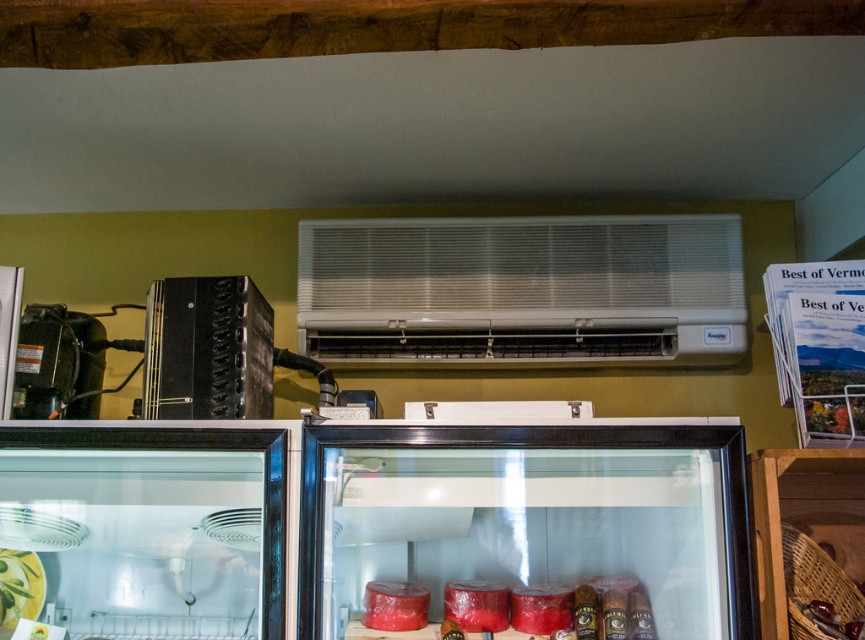
Does black matte accordion at left have a larger size compared to metallic black air conditioner at upper center?

Indeed, black matte accordion at left has a larger size compared to metallic black air conditioner at upper center.

Is black matte accordion at left taller than metallic black air conditioner at upper center?

Correct, black matte accordion at left is much taller as metallic black air conditioner at upper center.

The height and width of the screenshot is (640, 865). What do you see at coordinates (207, 349) in the screenshot?
I see `black matte accordion at left` at bounding box center [207, 349].

Find the location of a particular element. This screenshot has width=865, height=640. black matte accordion at left is located at coordinates (207, 349).

Between point (559, 625) and point (481, 604), which one is positioned behind?

The point (481, 604) is behind.

The height and width of the screenshot is (640, 865). Describe the element at coordinates (626, 604) in the screenshot. I see `shiny red plastic at center` at that location.

Between point (614, 596) and point (457, 596), which one is positioned behind?

Positioned behind is point (457, 596).

You are a GUI agent. You are given a task and a screenshot of the screen. Output one action in this format:
    pyautogui.click(x=<x>, y=<y>)
    Task: Click on the shiny red plastic at center
    This screenshot has width=865, height=640.
    Given the screenshot: What is the action you would take?
    pyautogui.click(x=626, y=604)

Is point (782, 588) more distant than point (393, 600)?

That is False.

Does wooden basket at lower right appear over red matte container at center?

Indeed, wooden basket at lower right is positioned over red matte container at center.

Find the location of a particular element. wooden basket at lower right is located at coordinates (803, 516).

You are a GUI agent. You are given a task and a screenshot of the screen. Output one action in this format:
    pyautogui.click(x=<x>, y=<y>)
    Task: Click on the wooden basket at lower right
    
    Given the screenshot: What is the action you would take?
    point(803,516)